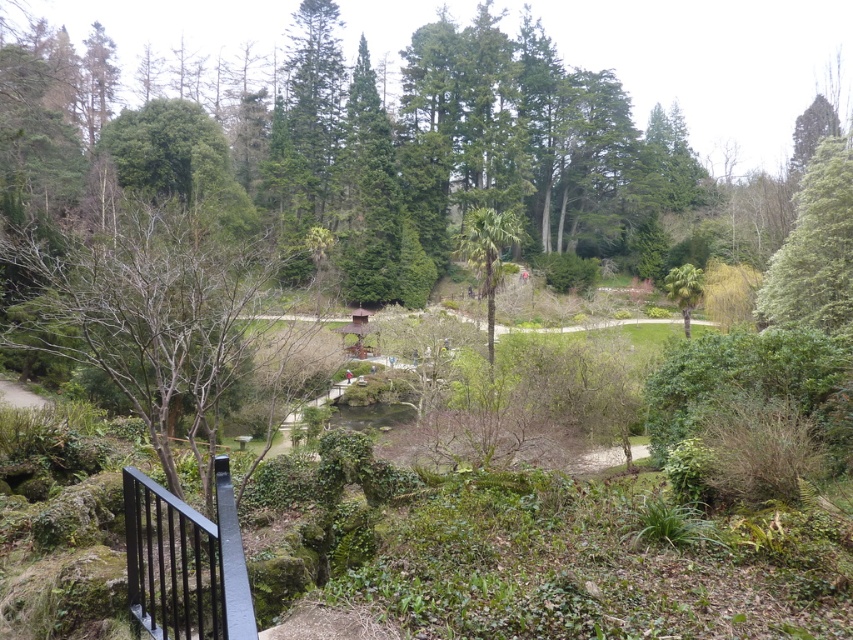
You are a landscape architect designing a new garden pathway. You need to ensure that the black metal rail at lower left and the green leafy palm tree at center are proportionally balanced. Which object should you consider adjusting in size to maintain harmony?

The black metal rail at lower left is thinner than the green leafy palm tree at center. To maintain proportional balance, you should consider thickening the black metal rail at lower left or thinning the green leafy palm tree at center.